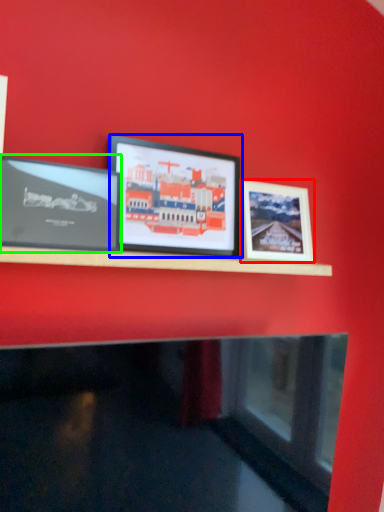
Question: Which is nearer to the picture frame (highlighted by a red box)? picture frame (highlighted by a blue box) or picture frame (highlighted by a green box).

Choices:
 (A) picture frame
 (B) picture frame

Answer: (A)